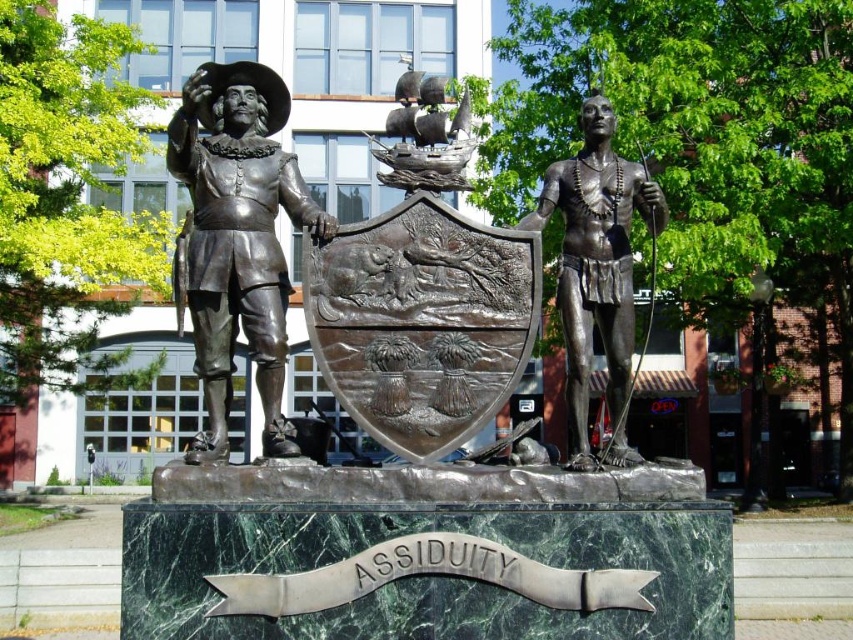
Does point (254, 156) lie behind point (569, 456)?

That is False.

Is bronze statue at left bigger than shiny bronze figure at center?

No.

Where is `bronze statue at left`? Image resolution: width=853 pixels, height=640 pixels. bronze statue at left is located at coordinates (236, 240).

Is bronze statue at center thinner than shiny bronze figure at center?

Yes.

Image resolution: width=853 pixels, height=640 pixels. What do you see at coordinates (419, 474) in the screenshot?
I see `bronze statue at center` at bounding box center [419, 474].

I want to click on bronze statue at center, so click(x=419, y=474).

Locate an element on the screen. bronze statue at center is located at coordinates (419, 474).

Between point (492, 342) and point (196, 179), which one is positioned in front?

Point (492, 342) is in front.

The width and height of the screenshot is (853, 640). What are the coordinates of `bronze statue at center` in the screenshot? It's located at (419, 474).

This screenshot has height=640, width=853. In order to click on bronze statue at center in this screenshot , I will do `click(419, 474)`.